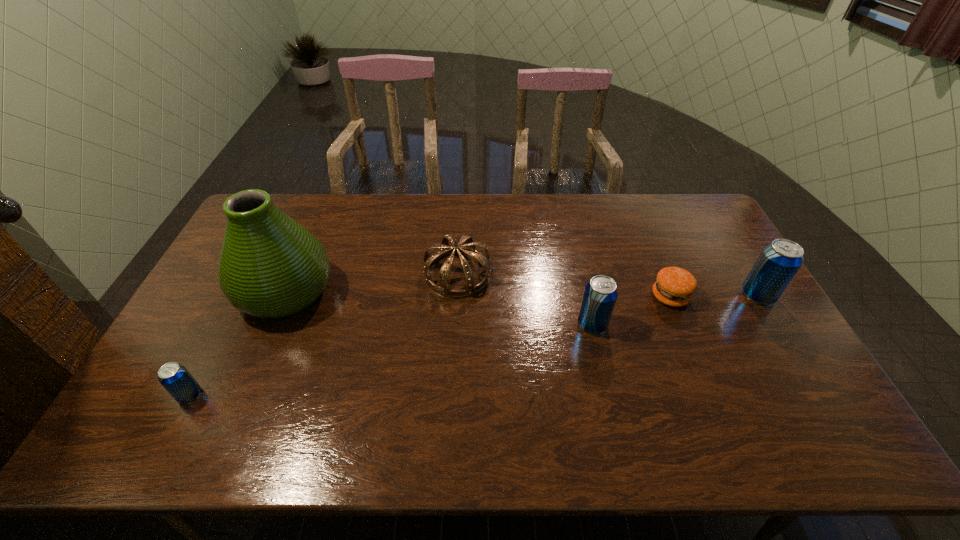
Locate an element on the screen. This screenshot has height=540, width=960. vacant area in the image that satisfies the following two spatial constraints: 1. on the back side of the fourth object from left to right; 2. on the right side of the second object from right to left is located at coordinates (586, 296).

Identify the location of free spot that satisfies the following two spatial constraints: 1. on the back side of the farthest beer can; 2. on the left side of the shortest object. (669, 295).

Image resolution: width=960 pixels, height=540 pixels. In order to click on free space that satisfies the following two spatial constraints: 1. on the back side of the tiara; 2. on the left side of the nearest beer can in this screenshot , I will do `click(252, 274)`.

This screenshot has width=960, height=540. I want to click on vacant position in the image that satisfies the following two spatial constraints: 1. on the back side of the farthest beer can; 2. on the left side of the second shortest beer can, so click(x=586, y=295).